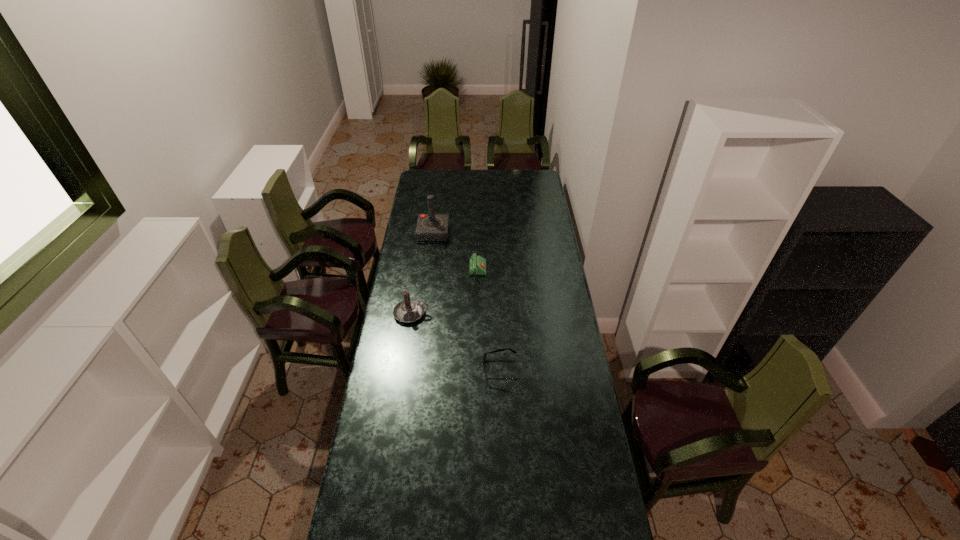
Where is `object that stands as the third closest to the shortest object`? The width and height of the screenshot is (960, 540). object that stands as the third closest to the shortest object is located at coordinates (430, 227).

At what (x,y) coordinates should I click in order to perform the action: click on object that stands as the third closest to the telephone. Please return your answer as a coordinate pair (x, y). Image resolution: width=960 pixels, height=540 pixels. Looking at the image, I should click on (484, 357).

Locate an element on the screen. This screenshot has height=540, width=960. free spot that satisfies the following two spatial constraints: 1. on the rectangular base of the farthest object; 2. on the side of the candle with the handle loop is located at coordinates (423, 313).

Locate an element on the screen. Image resolution: width=960 pixels, height=540 pixels. free space that satisfies the following two spatial constraints: 1. on the rectangular base of the joystick; 2. on the side of the candle with the handle loop is located at coordinates (423, 313).